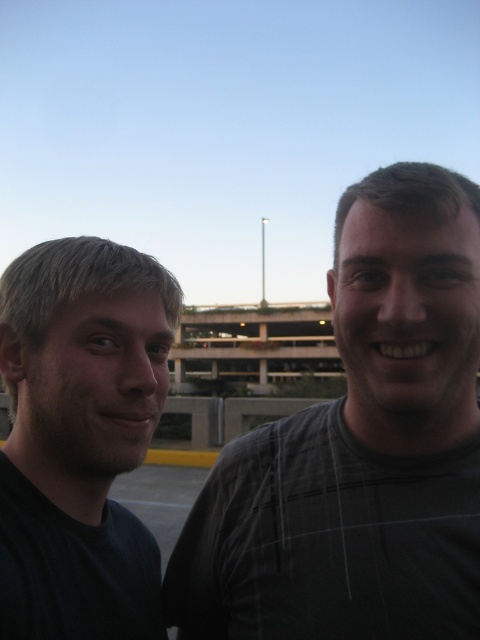
Question: Does dark gray plaid shirt at right appear over black matte shirt at left?

Choices:
 (A) yes
 (B) no

Answer: (A)

Question: Is dark gray plaid shirt at right below black matte shirt at left?

Choices:
 (A) no
 (B) yes

Answer: (A)

Question: Among these objects, which one is nearest to the camera?

Choices:
 (A) black matte shirt at left
 (B) dark gray plaid shirt at right

Answer: (A)

Question: Which object is farther from the camera taking this photo?

Choices:
 (A) black matte shirt at left
 (B) dark gray plaid shirt at right

Answer: (B)

Question: Can you confirm if dark gray plaid shirt at right is wider than black matte shirt at left?

Choices:
 (A) no
 (B) yes

Answer: (B)